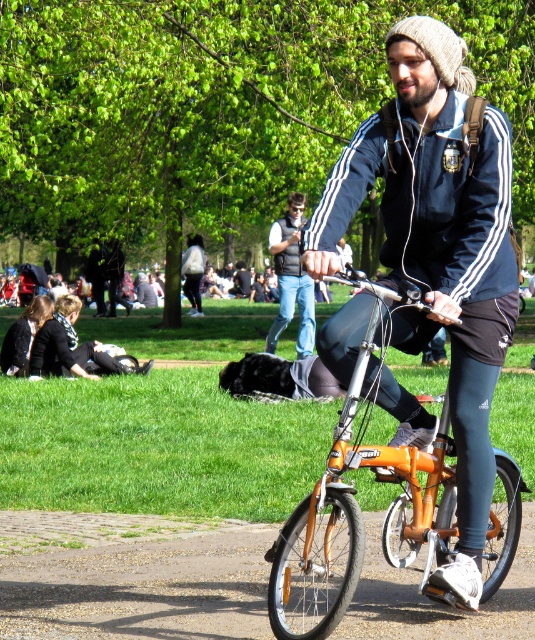
Is point (268, 348) positioned before point (72, 336)?

That is False.

What do you see at coordinates (292, 276) in the screenshot? The width and height of the screenshot is (535, 640). I see `denim jeans at center` at bounding box center [292, 276].

Who is more forward, (x=278, y=310) or (x=57, y=304)?

Point (x=57, y=304) is in front.

What are the coordinates of `denim jeans at center` in the screenshot? It's located at (292, 276).

Is orange metallic bicycle at center below denim jeans at center?

Correct, orange metallic bicycle at center is located below denim jeans at center.

Does orange metallic bicycle at center appear on the right side of denim jeans at center?

Indeed, orange metallic bicycle at center is positioned on the right side of denim jeans at center.

Between point (412, 492) and point (309, 285), which one is positioned in front?

Point (412, 492) is more forward.

Find the location of a particular element. The height and width of the screenshot is (640, 535). orange metallic bicycle at center is located at coordinates (356, 508).

Who is positioned more to the right, orange metallic bicycle at center or black fabric jacket at lower left?

Positioned to the right is orange metallic bicycle at center.

Is orange metallic bicycle at center above black fabric jacket at lower left?

No.

Between point (340, 525) and point (65, 307), which one is positioned in front?

Point (340, 525)

Identify the location of orange metallic bicycle at center. The width and height of the screenshot is (535, 640). (356, 508).